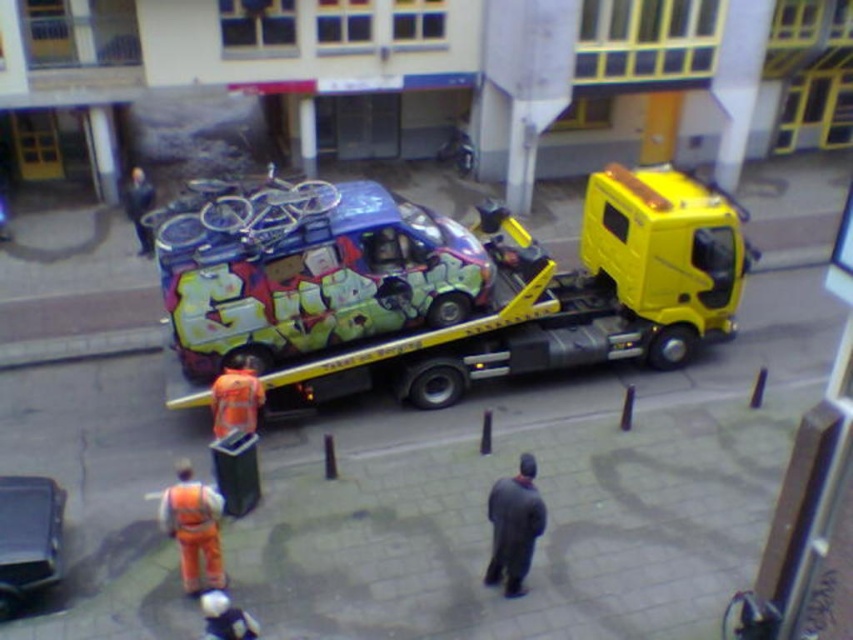
Question: Based on their relative distances, which object is farther from the reflective orange vest at lower left?

Choices:
 (A) graffiti-covered car at center
 (B) dark gray wool coat at center

Answer: (A)

Question: Does yellow metallic tow truck at center have a larger size compared to reflective orange vest at lower left?

Choices:
 (A) no
 (B) yes

Answer: (B)

Question: Does metallic blue car at lower left come in front of dark gray wool coat at center?

Choices:
 (A) no
 (B) yes

Answer: (A)

Question: Which point appears farthest from the camera in this image?

Choices:
 (A) (456, 320)
 (B) (54, 486)

Answer: (A)

Question: Is reflective orange vest at lower left further to camera compared to dark gray wool coat at center?

Choices:
 (A) yes
 (B) no

Answer: (A)

Question: Which of these objects is positioned closest to the graffiti-covered car at center?

Choices:
 (A) metallic blue car at lower left
 (B) yellow metallic tow truck at center
 (C) dark gray wool coat at center
 (D) reflective orange vest at lower left

Answer: (B)